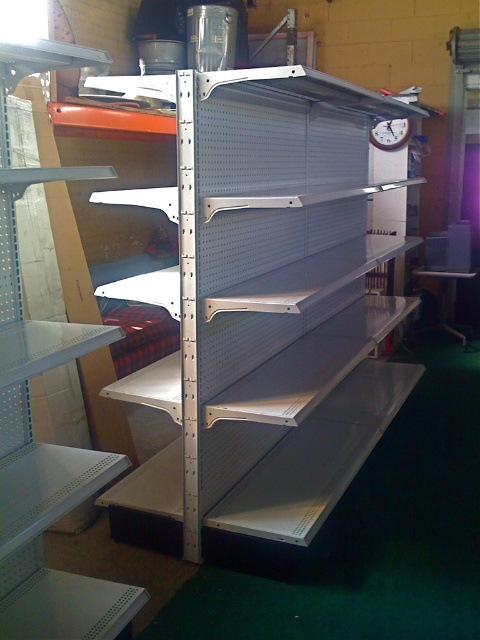
Does metallic gray shelves at center have a smaller size compared to metallic silver workbench at lower right?

No, metallic gray shelves at center is not smaller than metallic silver workbench at lower right.

Does metallic gray shelves at center have a larger size compared to metallic silver workbench at lower right?

Correct, metallic gray shelves at center is larger in size than metallic silver workbench at lower right.

Does point (346, 227) come behind point (445, 289)?

No, it is not.

Identify the location of metallic gray shelves at center. (268, 307).

Is metallic gray shelves at center closer to camera compared to white plastic clock at upper center?

Yes, metallic gray shelves at center is in front of white plastic clock at upper center.

Does point (230, 80) come farther from viewer compared to point (372, 134)?

No.

This screenshot has height=640, width=480. Describe the element at coordinates (268, 307) in the screenshot. I see `metallic gray shelves at center` at that location.

The image size is (480, 640). In order to click on metallic gray shelves at center in this screenshot , I will do `click(268, 307)`.

In the scene shown: Who is positioned more to the left, metallic silver shelves at center or metallic silver workbench at lower right?

Positioned to the left is metallic silver shelves at center.

What do you see at coordinates (31, 419) in the screenshot? I see `metallic silver shelves at center` at bounding box center [31, 419].

Identify the location of metallic silver shelves at center. This screenshot has width=480, height=640. (31, 419).